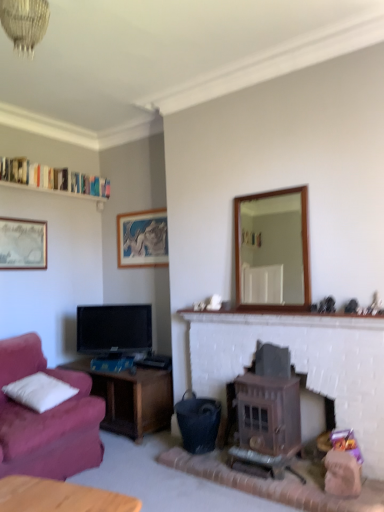
Question: Which is correct: crystal glass chandelier at upper center is inside matte black tv at left, or outside of it?

Choices:
 (A) outside
 (B) inside

Answer: (A)

Question: Would you say crystal glass chandelier at upper center is to the left or to the right of matte black tv at left in the picture?

Choices:
 (A) right
 (B) left

Answer: (A)

Question: Estimate the real-world distances between objects in this image. Which object is closer to the brown wooden wood burning stove at center-right?

Choices:
 (A) matte black tv at left
 (B) white wooden shelf at upper left
 (C) wooden-framed mirror at center-right
 (D) white brick fireplace at center
 (E) crystal glass chandelier at upper center

Answer: (D)

Question: Based on their relative distances, which object is nearer to the wooden-framed mirror at center-right?

Choices:
 (A) brown wooden wood burning stove at center-right
 (B) matte black tv at left
 (C) matte wooden picture frame at upper center, the second picture frame in the front-to-back sequence
 (D) crystal glass chandelier at upper center
 (E) white wooden shelf at upper left

Answer: (C)